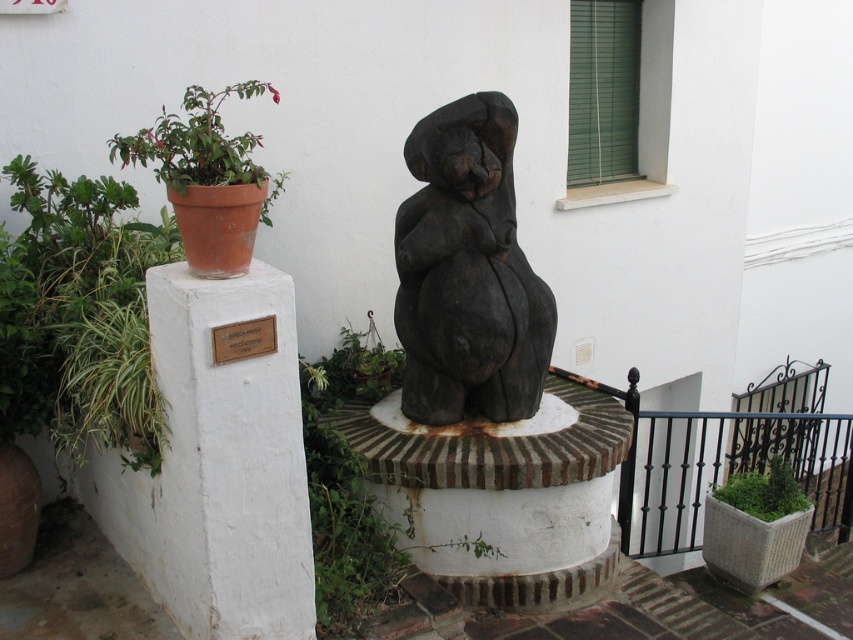
Question: Among these points, which one is farthest from the camera?

Choices:
 (A) (421, 413)
 (B) (729, 477)
 (C) (242, 340)
 (D) (166, 472)

Answer: (B)

Question: Is the position of green mossy planter at lower right less distant than that of brown leather plaque at center?

Choices:
 (A) no
 (B) yes

Answer: (A)

Question: Is green leafy plant at left to the left of green mossy planter at lower right from the viewer's perspective?

Choices:
 (A) yes
 (B) no

Answer: (A)

Question: Which of these objects is positioned closest to the green leafy plant at left?

Choices:
 (A) black wood statue at center
 (B) matte terracotta pot at left
 (C) white concrete pillar at left

Answer: (C)

Question: Considering the relative positions of green leafy plant at left and green mossy planter at lower right in the image provided, where is green leafy plant at left located with respect to green mossy planter at lower right?

Choices:
 (A) below
 (B) above

Answer: (B)

Question: Among these objects, which one is nearest to the camera?

Choices:
 (A) green leafy plant at left
 (B) white concrete pillar at left

Answer: (B)